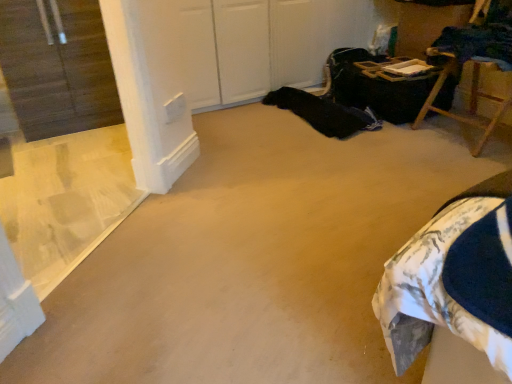
Question: Is transparent plastic window at left in front of or behind wooden folding chair at upper right in the image?

Choices:
 (A) front
 (B) behind

Answer: (A)

Question: Considering the relative positions of transparent plastic window at left and wooden folding chair at upper right in the image provided, is transparent plastic window at left to the left or to the right of wooden folding chair at upper right?

Choices:
 (A) right
 (B) left

Answer: (B)

Question: Considering the positions of transparent plastic window at left and wooden folding chair at upper right in the image, is transparent plastic window at left taller or shorter than wooden folding chair at upper right?

Choices:
 (A) short
 (B) tall

Answer: (B)

Question: From the image's perspective, is wooden folding chair at upper right above or below transparent plastic window at left?

Choices:
 (A) above
 (B) below

Answer: (A)

Question: Considering the relative positions of wooden folding chair at upper right and transparent plastic window at left in the image provided, is wooden folding chair at upper right to the left or to the right of transparent plastic window at left?

Choices:
 (A) left
 (B) right

Answer: (B)

Question: Do you think wooden folding chair at upper right is within transparent plastic window at left, or outside of it?

Choices:
 (A) outside
 (B) inside

Answer: (A)

Question: In terms of height, does wooden folding chair at upper right look taller or shorter compared to transparent plastic window at left?

Choices:
 (A) short
 (B) tall

Answer: (A)